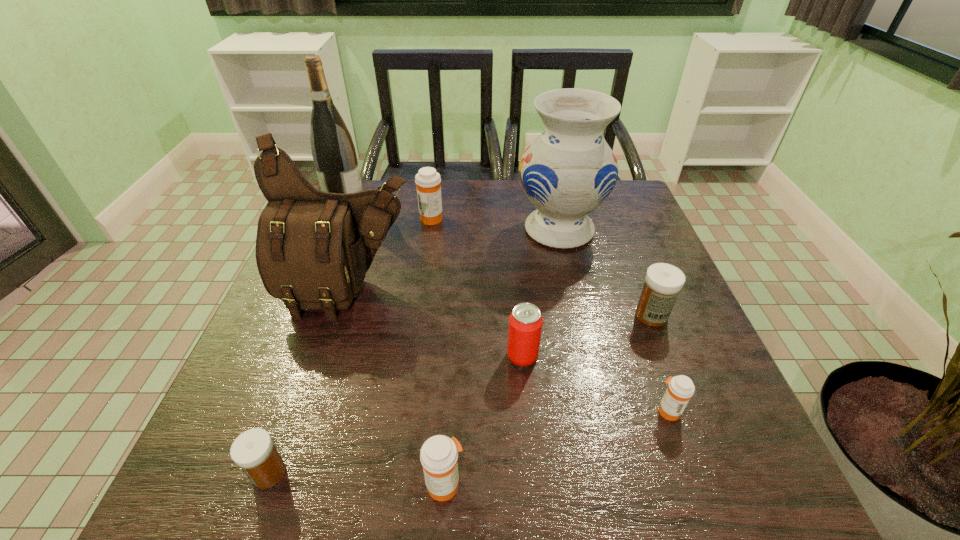
You are a GUI agent. You are given a task and a screenshot of the screen. Output one action in this format:
    pyautogui.click(x=<x>, y=<y>)
    Task: Click on the nearest orange medicine
    This screenshot has width=960, height=540.
    Given the screenshot: What is the action you would take?
    pyautogui.click(x=439, y=454)

At what (x,y) coordinates should I click in order to perform the action: click on the smallest orange medicine. Please return your answer as a coordinate pair (x, y). The width and height of the screenshot is (960, 540). Looking at the image, I should click on (680, 389).

What are the coordinates of `the rightmost orange medicine` in the screenshot? It's located at (680, 389).

At what (x,y) coordinates should I click in order to perform the action: click on the smaller white medicine. Please return your answer as a coordinate pair (x, y). Image resolution: width=960 pixels, height=540 pixels. Looking at the image, I should click on (253, 451).

Locate an element on the screen. Image resolution: width=960 pixels, height=540 pixels. the nearer white medicine is located at coordinates (253, 451).

Find the location of `free point located 0.110m on the label of the brown wine bottle`. free point located 0.110m on the label of the brown wine bottle is located at coordinates (402, 202).

Find the location of a particular element. The image size is (960, 540). vacant region located 0.220m on the left of the vase is located at coordinates pyautogui.click(x=435, y=230).

I want to click on free space located 0.190m on the front-facing side of the shoulder bag, so coord(316,400).

I want to click on blank area located 0.260m on the left of the leftmost orange medicine, so click(x=327, y=218).

Where is `vacant space located on the left of the red beer can`? This screenshot has width=960, height=540. vacant space located on the left of the red beer can is located at coordinates (307, 356).